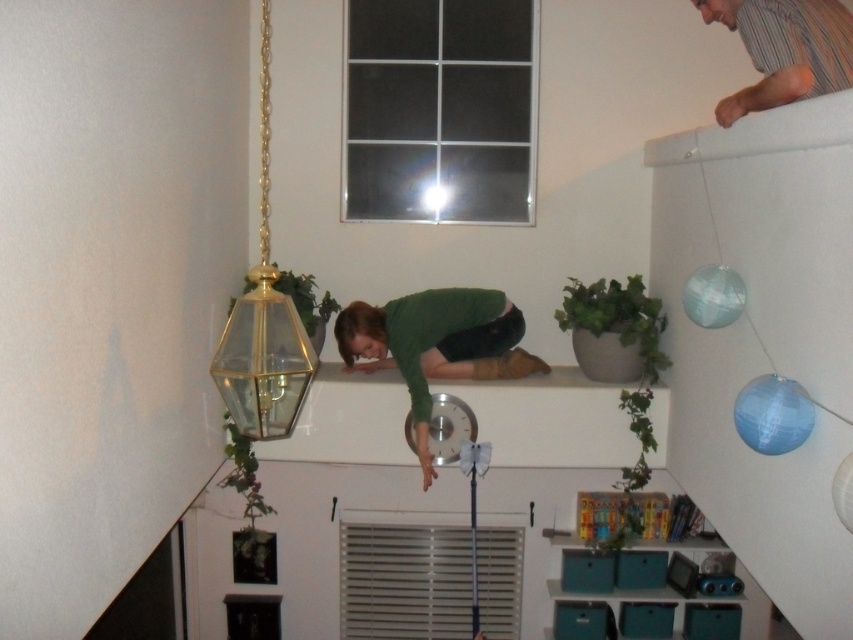
Between point (602, 371) and point (244, 440), which one is positioned in front?

Positioned in front is point (244, 440).

Can you confirm if green matte plant pot at center is positioned below green leafy plant at lower left?

No.

You are a GUI agent. You are given a task and a screenshot of the screen. Output one action in this format:
    pyautogui.click(x=<x>, y=<y>)
    Task: Click on the green matte plant pot at center
    
    Given the screenshot: What is the action you would take?
    pyautogui.click(x=613, y=330)

Does green fabric shirt at center lie in front of green leafy plant at lower left?

That is True.

Is green fabric shirt at center smaller than green leafy plant at lower left?

No.

Between point (361, 321) and point (228, 422), which one is positioned behind?

The point (228, 422) is more distant.

This screenshot has width=853, height=640. In order to click on green fabric shirt at center in this screenshot , I will do `click(436, 344)`.

Which of these two, striped fabric shirt at upper right or green leafy plant at lower left, stands shorter?

With less height is striped fabric shirt at upper right.

Consider the image. Is striped fabric shirt at upper right further to the viewer compared to green leafy plant at lower left?

No, it is not.

Who is more forward, [825,48] or [242,438]?

Point [825,48]

Find the location of a particular element. The image size is (853, 640). striped fabric shirt at upper right is located at coordinates (784, 49).